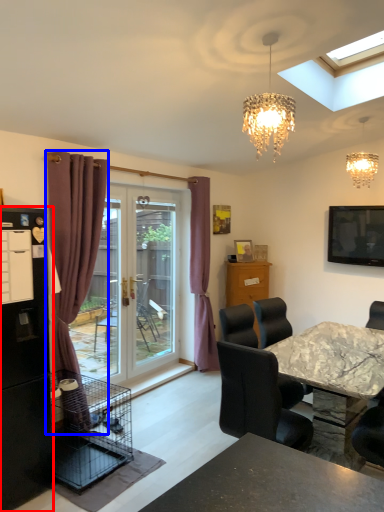
Question: Which object appears farthest to the camera in this image, refrigerator (highlighted by a red box) or curtain (highlighted by a blue box)?

Choices:
 (A) refrigerator
 (B) curtain

Answer: (B)